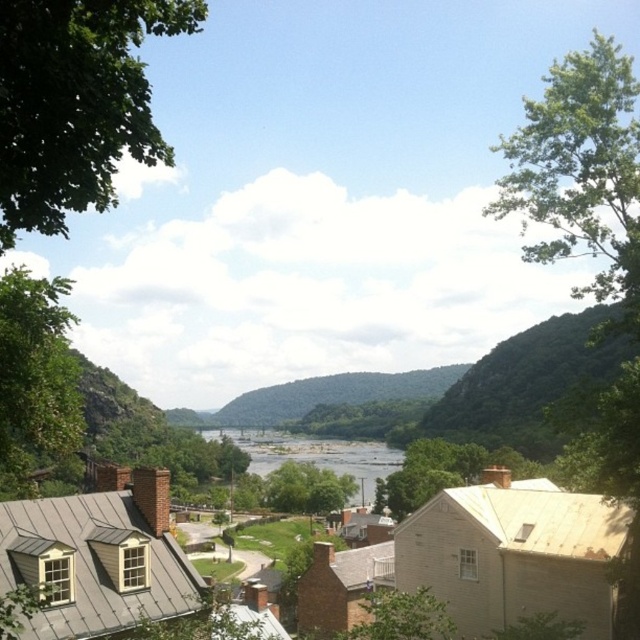
You are a hiker who wants to cross the river using a bridge that is 100 meters long. The bridge can only be placed between the green leafy tree at upper right and clear water at center. Will the bridge fit between them?

The distance between the green leafy tree at upper right and clear water at center is 125.02 meters. Since the bridge is 100 meters long, it will fit between them with 25.02 meters of space remaining.